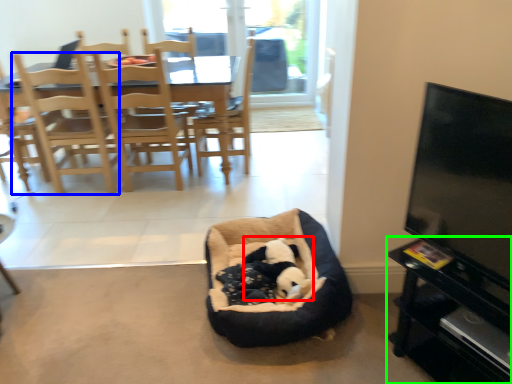
Question: Which object is the closest to the animal (highlighted by a red box)? Choose among these: chair (highlighted by a blue box) or entertainment center (highlighted by a green box).

Choices:
 (A) chair
 (B) entertainment center

Answer: (B)